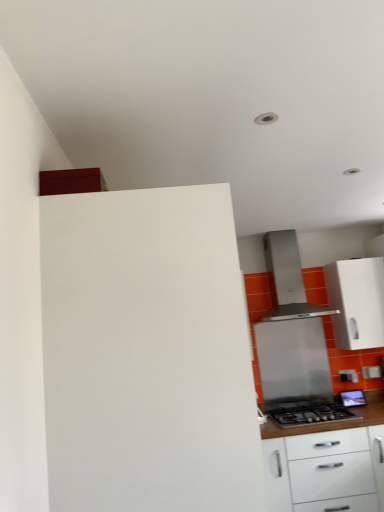
Where is `white matte cabinet at upper left, which is the 3th cabinetry in right-to-left order`? The width and height of the screenshot is (384, 512). white matte cabinet at upper left, which is the 3th cabinetry in right-to-left order is located at coordinates (147, 353).

The height and width of the screenshot is (512, 384). What do you see at coordinates (288, 279) in the screenshot? I see `stainless steel range hood at center` at bounding box center [288, 279].

This screenshot has width=384, height=512. Describe the element at coordinates (309, 414) in the screenshot. I see `stainless steel gas stove at lower right` at that location.

You are a GUI agent. You are given a task and a screenshot of the screen. Output one action in this format:
    pyautogui.click(x=<x>, y=<y>)
    Task: Click on the white glossy cabinet at lower right, which is the 2th cabinetry in right-to-left order
    
    Given the screenshot: What is the action you would take?
    pyautogui.click(x=326, y=464)

In terms of height, does white glossy cabinet at lower right, the second cabinetry when ordered from back to front, look taller or shorter compared to stainless steel range hood at center?

white glossy cabinet at lower right, the second cabinetry when ordered from back to front, is taller than stainless steel range hood at center.

From a real-world perspective, who is located higher, white glossy cabinet at lower right, which appears as the 2th cabinetry when viewed from the front, or stainless steel range hood at center?

stainless steel range hood at center is physically above.

From the image's perspective, is white glossy cabinet at lower right, which appears as the 2th cabinetry when viewed from the left, positioned above or below stainless steel range hood at center?

white glossy cabinet at lower right, which appears as the 2th cabinetry when viewed from the left, is below stainless steel range hood at center.

This screenshot has height=512, width=384. Identify the location of gas stove on the right side of stainless steel range hood at center. (309, 414).

Considering the positions of point (299, 270) and point (293, 407), is point (299, 270) closer or farther from the camera than point (293, 407)?

Clearly, point (299, 270) is more distant from the camera than point (293, 407).

Is stainless steel range hood at center positioned with its back to stainless steel gas stove at lower right?

No, stainless steel range hood at center is not facing away from stainless steel gas stove at lower right.

Considering the sizes of objects stainless steel range hood at center and stainless steel gas stove at lower right in the image provided, who is bigger, stainless steel range hood at center or stainless steel gas stove at lower right?

With larger size is stainless steel range hood at center.

From the stainless steel range hood at center, count 2nd cabinetry to the right and point to it. Please provide its 2D coordinates.

[(357, 302)]

Is white glossy cabinet at right, the first cabinetry positioned from the back, positioned with its back to stainless steel range hood at center?

white glossy cabinet at right, the first cabinetry positioned from the back, is not turned away from stainless steel range hood at center.

From a real-world perspective, who is located higher, white glossy cabinet at right, the first cabinetry positioned from the back, or stainless steel range hood at center?

white glossy cabinet at right, the first cabinetry positioned from the back, is physically above.

Could you measure the distance between white glossy cabinet at lower right, the second cabinetry when ordered from back to front, and stainless steel range hood at center?

The distance of white glossy cabinet at lower right, the second cabinetry when ordered from back to front, from stainless steel range hood at center is 3.72 feet.

In terms of size, does white glossy cabinet at lower right, the second cabinetry when ordered from back to front, appear bigger or smaller than stainless steel range hood at center?

Considering their sizes, white glossy cabinet at lower right, the second cabinetry when ordered from back to front, takes up more space than stainless steel range hood at center.

Can you confirm if white glossy cabinet at lower right, which appears as the 2th cabinetry when viewed from the left, is shorter than stainless steel range hood at center?

No.

From the picture: Which object is further away from the camera, white glossy cabinet at lower right, the second cabinetry when ordered from back to front, or stainless steel range hood at center?

Positioned behind is stainless steel range hood at center.

Can you tell me how much stainless steel gas stove at lower right and white glossy cabinet at right, the first cabinetry positioned from the back, differ in facing direction?

The angle between the facing direction of stainless steel gas stove at lower right and the facing direction of white glossy cabinet at right, the first cabinetry positioned from the back, is 1.35 degrees.

Is point (274, 409) positioned before point (342, 323)?

Yes.

Which is in front, stainless steel gas stove at lower right or white glossy cabinet at right, the first cabinetry positioned from the back?

stainless steel gas stove at lower right is closer to the camera.

Is stainless steel gas stove at lower right turned away from stainless steel range hood at center?

No, stainless steel gas stove at lower right is not facing the opposite direction of stainless steel range hood at center.

From the image's perspective, is stainless steel gas stove at lower right below stainless steel range hood at center?

Yes, from the image's perspective, stainless steel gas stove at lower right is below stainless steel range hood at center.

Looking at this image, are stainless steel gas stove at lower right and stainless steel range hood at center beside each other?

No, stainless steel gas stove at lower right is not in contact with stainless steel range hood at center.

Between white matte cabinet at upper left, which ranks as the 3th cabinetry in back-to-front order, and stainless steel range hood at center, which one has larger size?

white matte cabinet at upper left, which ranks as the 3th cabinetry in back-to-front order, is bigger.

From the image's perspective, relative to stainless steel range hood at center, is white matte cabinet at upper left, which is the 3th cabinetry in right-to-left order, above or below?

white matte cabinet at upper left, which is the 3th cabinetry in right-to-left order, is below stainless steel range hood at center.

Does white matte cabinet at upper left, acting as the 1th cabinetry starting from the front, appear on the left side of stainless steel range hood at center?

Yes, white matte cabinet at upper left, acting as the 1th cabinetry starting from the front, is to the left of stainless steel range hood at center.

Measure the distance from white matte cabinet at upper left, which is counted as the first cabinetry, starting from the left, to stainless steel range hood at center.

white matte cabinet at upper left, which is counted as the first cabinetry, starting from the left, is 8.09 feet from stainless steel range hood at center.

The height and width of the screenshot is (512, 384). Identify the location of cabinetry that is the 2nd object located in front of the stainless steel range hood at center. (326, 464).

Identify the location of kitchen appliance behind the stainless steel gas stove at lower right. (288, 279).

Based on their spatial positions, is stainless steel range hood at center or stainless steel gas stove at lower right further from white glossy cabinet at lower right, which appears as the 2th cabinetry when viewed from the front?

stainless steel range hood at center is positioned further to the anchor white glossy cabinet at lower right, which appears as the 2th cabinetry when viewed from the front.

Estimate the real-world distances between objects in this image. Which object is further from stainless steel range hood at center, stainless steel gas stove at lower right or white glossy cabinet at right, which is counted as the 3th cabinetry, starting from the front?

stainless steel gas stove at lower right.

Estimate the real-world distances between objects in this image. Which object is further from stainless steel range hood at center, white matte cabinet at upper left, which is counted as the first cabinetry, starting from the left, or white glossy cabinet at right, the first cabinetry positioned from the back?

The object further to stainless steel range hood at center is white matte cabinet at upper left, which is counted as the first cabinetry, starting from the left.

Looking at the image, which one is located further to white glossy cabinet at right, acting as the first cabinetry starting from the right, white matte cabinet at upper left, which is counted as the first cabinetry, starting from the left, or stainless steel range hood at center?

white matte cabinet at upper left, which is counted as the first cabinetry, starting from the left, is further to white glossy cabinet at right, acting as the first cabinetry starting from the right.

Looking at this image, estimate the real-world distances between objects in this image. Which object is further from white glossy cabinet at lower right, which appears as the 2th cabinetry when viewed from the front, stainless steel range hood at center or white glossy cabinet at right, the first cabinetry positioned from the back?

white glossy cabinet at right, the first cabinetry positioned from the back, is positioned further to the anchor white glossy cabinet at lower right, which appears as the 2th cabinetry when viewed from the front.

From the picture: When comparing their distances from stainless steel range hood at center, does white matte cabinet at upper left, acting as the 1th cabinetry starting from the front, or stainless steel range hood at center seem further?

white matte cabinet at upper left, acting as the 1th cabinetry starting from the front, is further to stainless steel range hood at center.

Considering their positions, is stainless steel range hood at center positioned further to stainless steel range hood at center than white glossy cabinet at lower right, which appears as the 2th cabinetry when viewed from the front?

white glossy cabinet at lower right, which appears as the 2th cabinetry when viewed from the front.

Looking at the image, which one is located closer to white matte cabinet at upper left, which is counted as the first cabinetry, starting from the left, stainless steel range hood at center or white glossy cabinet at right, the first cabinetry positioned from the back?

stainless steel range hood at center.

Identify the location of gas stove between white matte cabinet at upper left, which ranks as the 3th cabinetry in back-to-front order, and white glossy cabinet at right, which is counted as the 3th cabinetry, starting from the front, in the front-back direction. (309, 414).

This screenshot has height=512, width=384. What are the coordinates of `appliance between white glossy cabinet at right, which is counted as the 3th cabinetry, starting from the front, and white glossy cabinet at lower right, which appears as the 2th cabinetry when viewed from the left, vertically` in the screenshot? It's located at (292, 360).

This screenshot has width=384, height=512. I want to click on gas stove between white glossy cabinet at lower right, the second cabinetry when ordered from back to front, and stainless steel range hood at center in the front-back direction, so click(x=309, y=414).

The width and height of the screenshot is (384, 512). What are the coordinates of `gas stove positioned between white matte cabinet at upper left, which ranks as the 3th cabinetry in back-to-front order, and stainless steel range hood at center from near to far` in the screenshot? It's located at (309, 414).